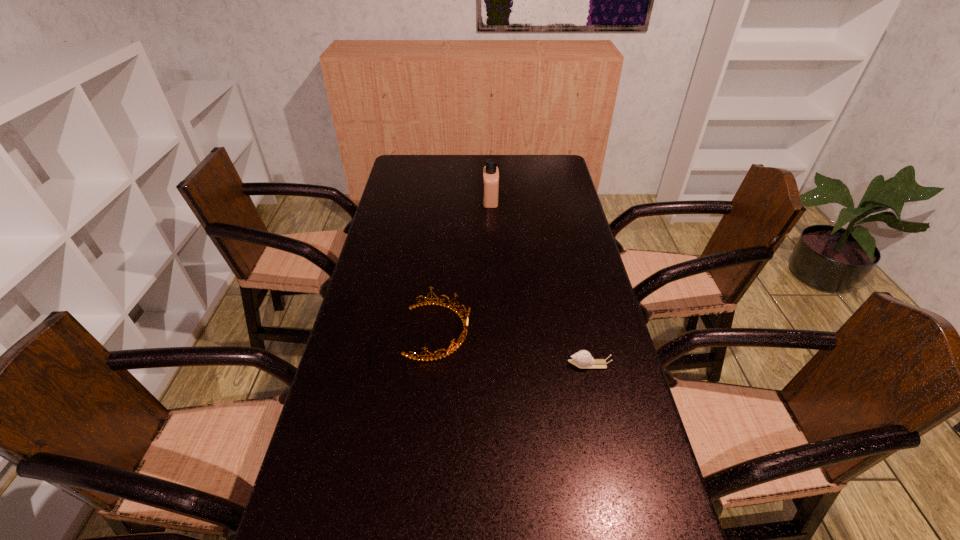
Locate an element on the screen. The height and width of the screenshot is (540, 960). object that is the second closest to the perfume is located at coordinates (582, 359).